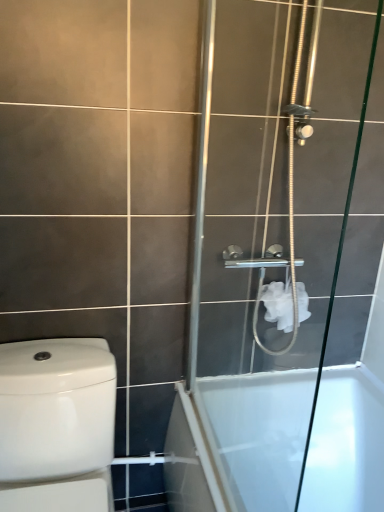
Question: From a real-world perspective, is white glossy bathtub at lower right positioned under white glossy toilet at left based on gravity?

Choices:
 (A) no
 (B) yes

Answer: (B)

Question: Is white glossy bathtub at lower right far from white glossy toilet at left?

Choices:
 (A) no
 (B) yes

Answer: (A)

Question: From the image's perspective, would you say white glossy bathtub at lower right is positioned over white glossy toilet at left?

Choices:
 (A) yes
 (B) no

Answer: (B)

Question: Is white glossy bathtub at lower right to the right of white glossy toilet at left from the viewer's perspective?

Choices:
 (A) yes
 (B) no

Answer: (A)

Question: Is white glossy bathtub at lower right further to the viewer compared to white glossy toilet at left?

Choices:
 (A) yes
 (B) no

Answer: (A)

Question: Is white glossy bathtub at lower right beside white glossy toilet at left?

Choices:
 (A) no
 (B) yes

Answer: (A)

Question: Does white matte toilet paper at upper right turn towards clear glass shower door at right?

Choices:
 (A) yes
 (B) no

Answer: (B)

Question: Is white matte toilet paper at upper right positioned before clear glass shower door at right?

Choices:
 (A) yes
 (B) no

Answer: (B)

Question: From a real-world perspective, is white matte toilet paper at upper right positioned under clear glass shower door at right based on gravity?

Choices:
 (A) no
 (B) yes

Answer: (B)

Question: Can you confirm if white matte toilet paper at upper right is smaller than clear glass shower door at right?

Choices:
 (A) yes
 (B) no

Answer: (A)

Question: Considering the relative positions of white matte toilet paper at upper right and clear glass shower door at right in the image provided, is white matte toilet paper at upper right to the right of clear glass shower door at right from the viewer's perspective?

Choices:
 (A) no
 (B) yes

Answer: (B)

Question: Can you confirm if white matte toilet paper at upper right is thinner than clear glass shower door at right?

Choices:
 (A) yes
 (B) no

Answer: (B)

Question: Can you confirm if clear glass shower door at right is smaller than white glossy toilet at left?

Choices:
 (A) no
 (B) yes

Answer: (B)